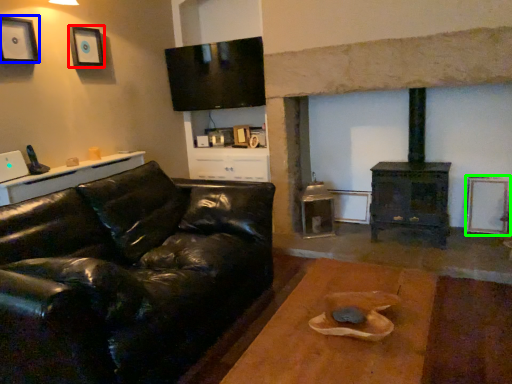
Question: Estimate the real-world distances between objects in this image. Which object is farther from picture frame (highlighted by a red box), picture frame (highlighted by a blue box) or picture frame (highlighted by a green box)?

Choices:
 (A) picture frame
 (B) picture frame

Answer: (B)